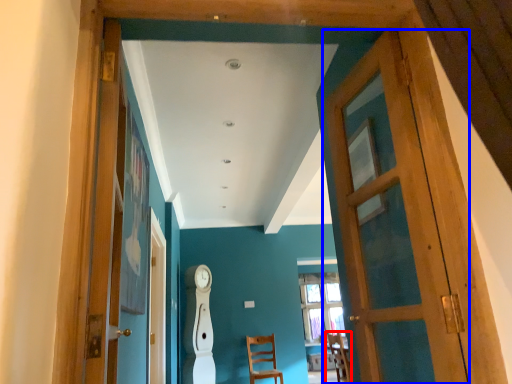
Question: Which object appears farthest to the camera in this image, chair (highlighted by a red box) or door (highlighted by a blue box)?

Choices:
 (A) chair
 (B) door

Answer: (A)